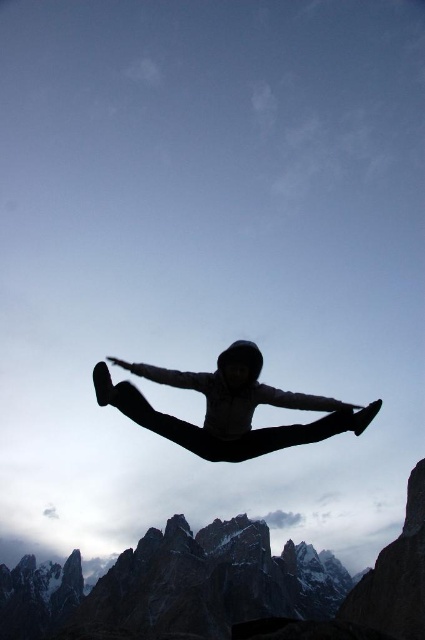
Question: Observing the image, what is the correct spatial positioning of rugged stone mountain at center in reference to black matte person at center?

Choices:
 (A) above
 (B) below

Answer: (B)

Question: Does rugged stone mountain at center appear on the left side of black matte person at center?

Choices:
 (A) yes
 (B) no

Answer: (A)

Question: Which of the following is the farthest from the observer?

Choices:
 (A) black matte person at center
 (B) rugged stone mountain at center

Answer: (A)

Question: Which point is closer to the camera?

Choices:
 (A) black matte person at center
 (B) rugged stone mountain at center

Answer: (B)

Question: Can you confirm if rugged stone mountain at center is bigger than black matte person at center?

Choices:
 (A) yes
 (B) no

Answer: (A)